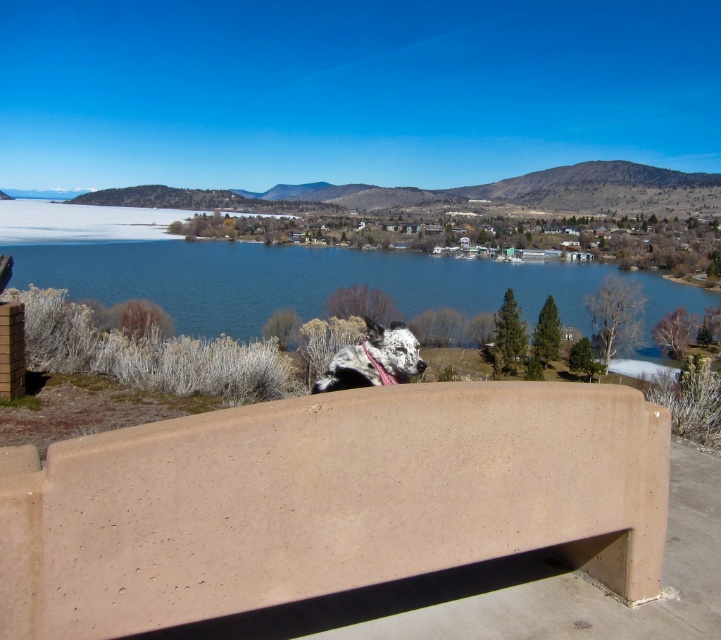
Question: Which point is closer to the camera taking this photo?

Choices:
 (A) 274,291
 (B) 624,588

Answer: (B)

Question: Can you confirm if matte concrete bench at center is wider than blue water at center?

Choices:
 (A) no
 (B) yes

Answer: (A)

Question: Considering the relative positions of matte concrete bench at center and blue water at center in the image provided, where is matte concrete bench at center located with respect to blue water at center?

Choices:
 (A) left
 (B) right

Answer: (B)

Question: Which object appears farthest from the camera in this image?

Choices:
 (A) matte concrete bench at center
 (B) blue water at center

Answer: (B)

Question: Which of the following is the closest to the observer?

Choices:
 (A) (138, 461)
 (B) (133, 260)

Answer: (A)

Question: Is matte concrete bench at center further to camera compared to blue water at center?

Choices:
 (A) yes
 (B) no

Answer: (B)